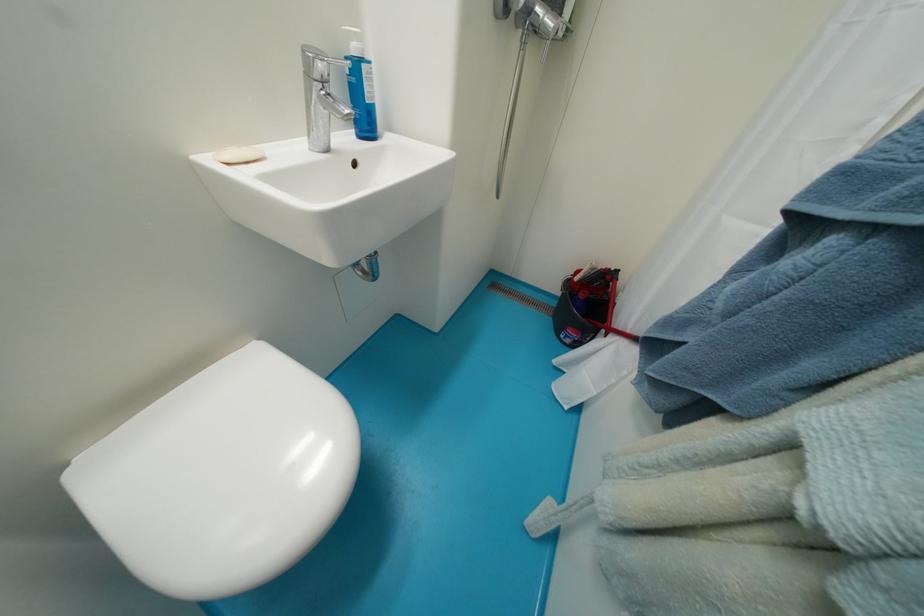
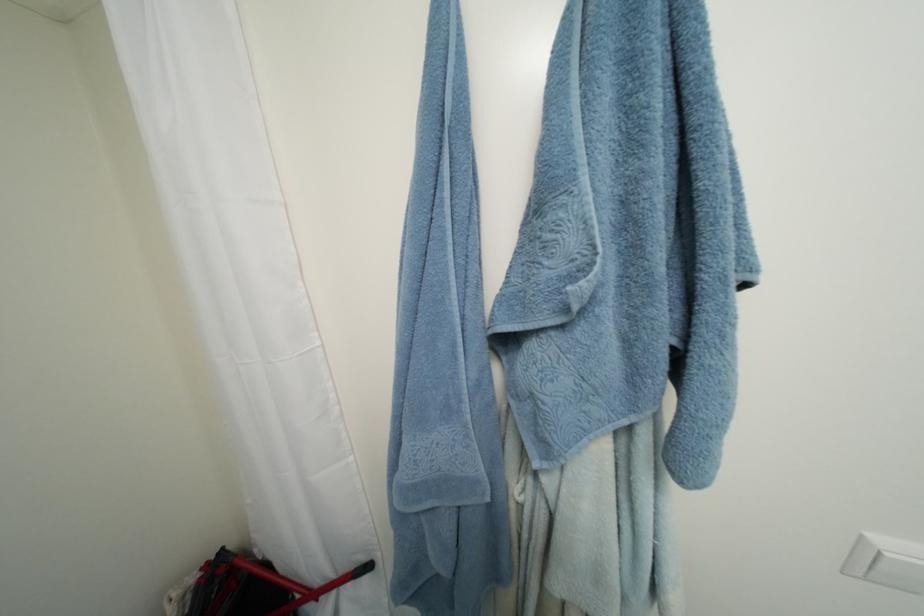
Find the pixel in the second image that matches pixel 625 273 in the first image.

(229, 552)